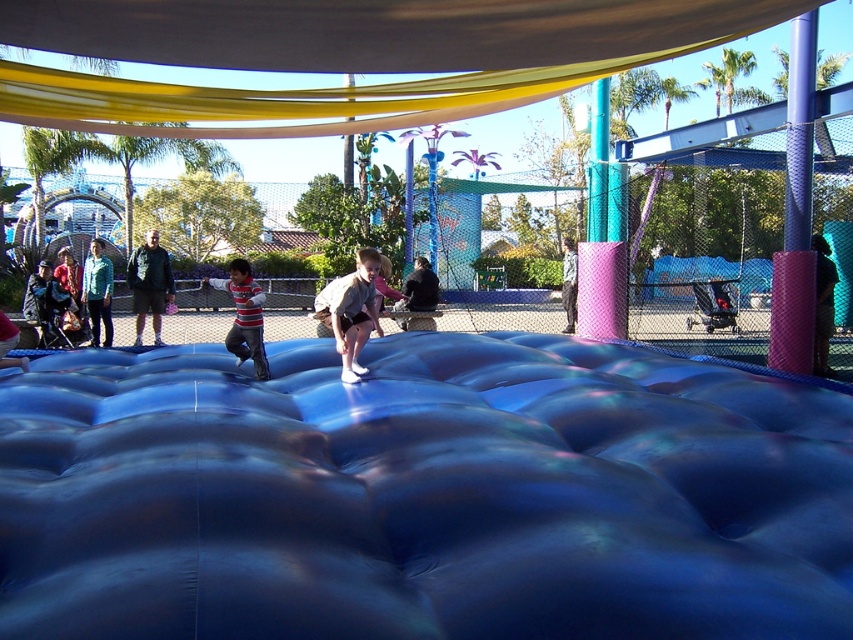
Does matte gray shorts at center have a larger size compared to striped cotton shirt at center?

Yes.

Who is positioned more to the left, matte gray shorts at center or striped cotton shirt at center?

striped cotton shirt at center

Describe the element at coordinates (350, 310) in the screenshot. This screenshot has width=853, height=640. I see `matte gray shorts at center` at that location.

Image resolution: width=853 pixels, height=640 pixels. What are the coordinates of `matte gray shorts at center` in the screenshot? It's located at (350, 310).

In the scene shown: Does matte gray shorts at center have a lesser height compared to dark green jacket at center?

Indeed, matte gray shorts at center has a lesser height compared to dark green jacket at center.

Who is more forward, (369, 284) or (141, 282)?

Point (369, 284) is more forward.

Image resolution: width=853 pixels, height=640 pixels. What do you see at coordinates (350, 310) in the screenshot? I see `matte gray shorts at center` at bounding box center [350, 310].

The width and height of the screenshot is (853, 640). I want to click on matte gray shorts at center, so click(x=350, y=310).

Which of these two, yellow fabric canopy at upper center or striped cotton shirt at center, stands shorter?

yellow fabric canopy at upper center is shorter.

I want to click on yellow fabric canopy at upper center, so click(346, 56).